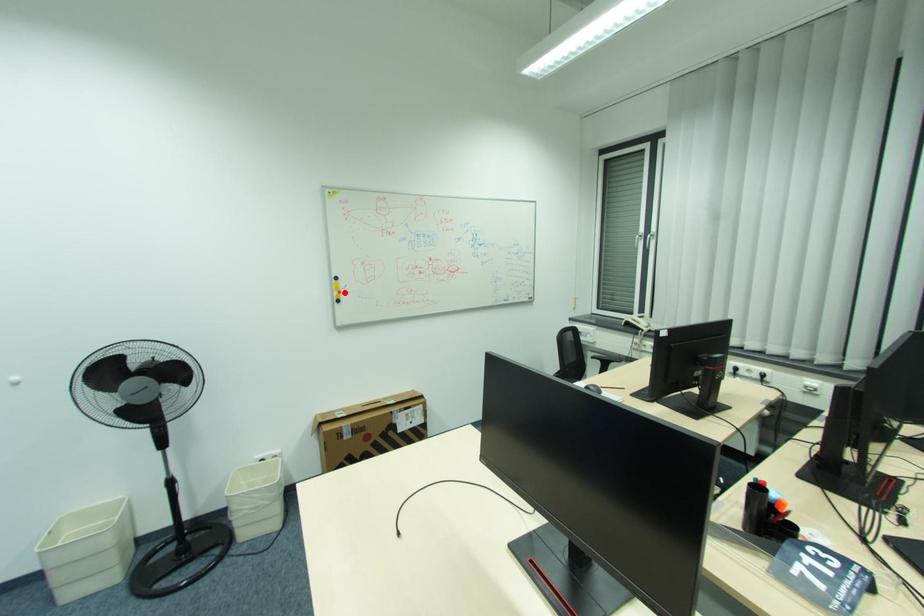
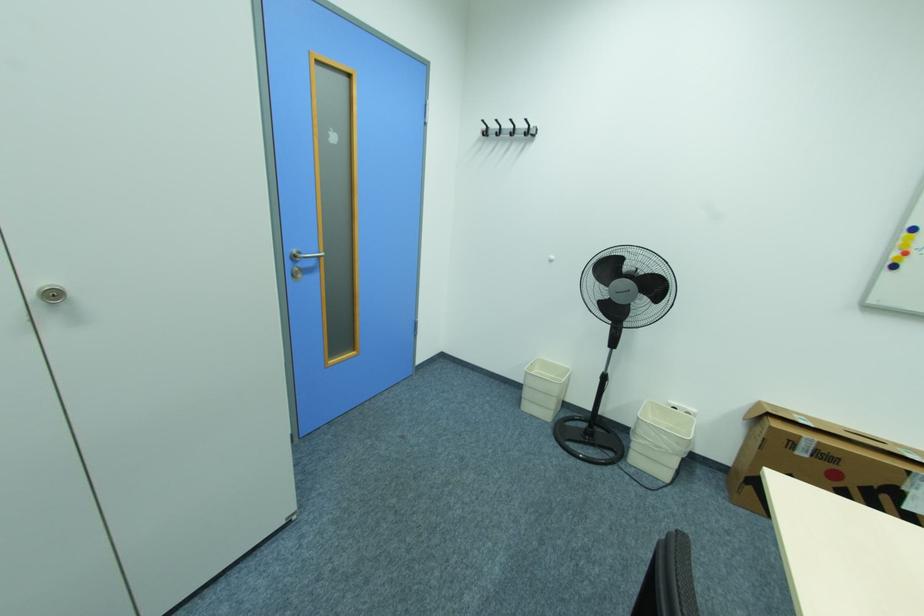
Where in the second image is the point corresponding to the highlighted location from the first image?

(910, 253)